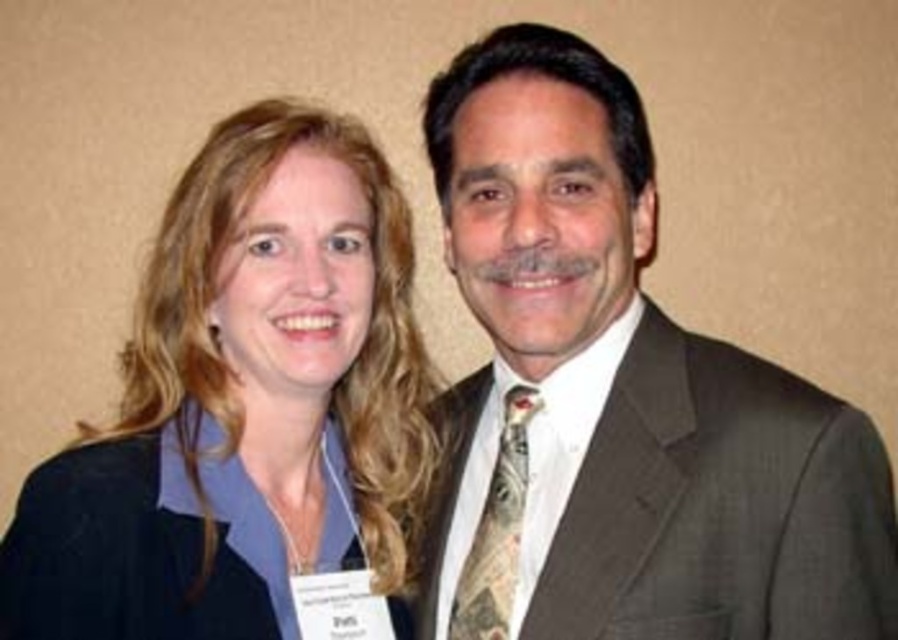
You are a photographer setting up for a portrait session. You notice the dark brown suit at center and the patterned silk tie at center in the image. Which object is positioned to the right side of the other?

The dark brown suit at center is to the right of the patterned silk tie at center, so the dark brown suit at center is positioned to the right of the patterned silk tie at center.

In the scene shown: You are a photographer setting up for a portrait session. You have a matte black blazer at center and a patterned silk tie at center in the frame. Which item takes up more space in the photo?

The matte black blazer at center is bigger than the patterned silk tie at center, so it takes up more space in the photo.